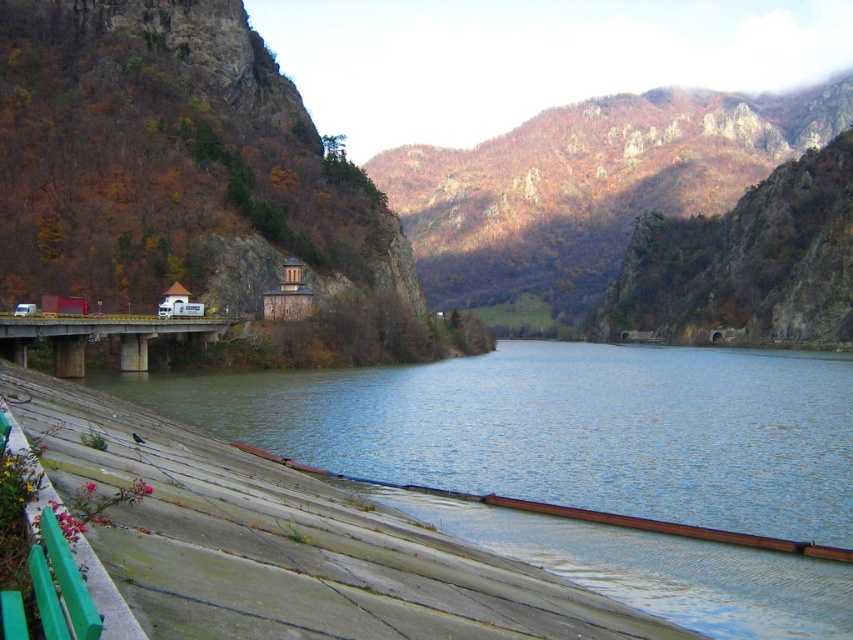
A drone is flying at a point with coordinates point at [751,490]. The drone needs to deliver a package to a location 57.62 meters away. If the drone flies directly towards the chapel on the left bank, will it reach the destination in time for the event scheduled in 2 minutes? Assume the drone flies at a constant speed of 30 m per minute.

The distance between the drone at point at [751,490] and the chapel on the left bank is 57.62 meters. Since the drone flies at 30 meters per minute, it would take 1.92 minutes to reach the destination, which is within the 2 minutes scheduled time. Yes, the drone will arrive on time.